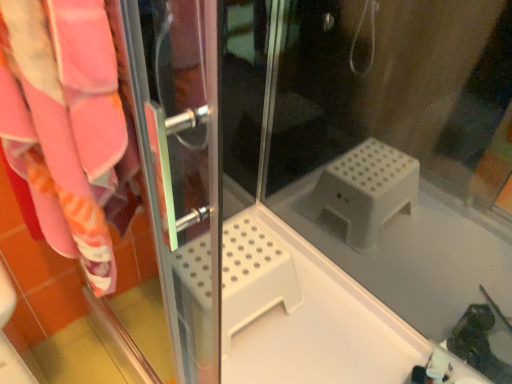
Question: In terms of height, does transparent plastic step stool at center look taller or shorter compared to transparent plastic screen door at left?

Choices:
 (A) short
 (B) tall

Answer: (B)

Question: Considering the positions of point tap(488, 147) and point tap(128, 180), is point tap(488, 147) closer or farther from the camera than point tap(128, 180)?

Choices:
 (A) farther
 (B) closer

Answer: (A)

Question: Is transparent plastic step stool at center wider or thinner than transparent plastic screen door at left?

Choices:
 (A) thin
 (B) wide

Answer: (B)

Question: From their relative heights in the image, would you say transparent plastic screen door at left is taller or shorter than transparent plastic step stool at center?

Choices:
 (A) short
 (B) tall

Answer: (A)

Question: Visually, is transparent plastic screen door at left positioned to the left or to the right of transparent plastic step stool at center?

Choices:
 (A) left
 (B) right

Answer: (A)

Question: From the image's perspective, is transparent plastic screen door at left located above or below transparent plastic step stool at center?

Choices:
 (A) above
 (B) below

Answer: (B)

Question: In terms of width, does transparent plastic screen door at left look wider or thinner when compared to transparent plastic step stool at center?

Choices:
 (A) thin
 (B) wide

Answer: (A)